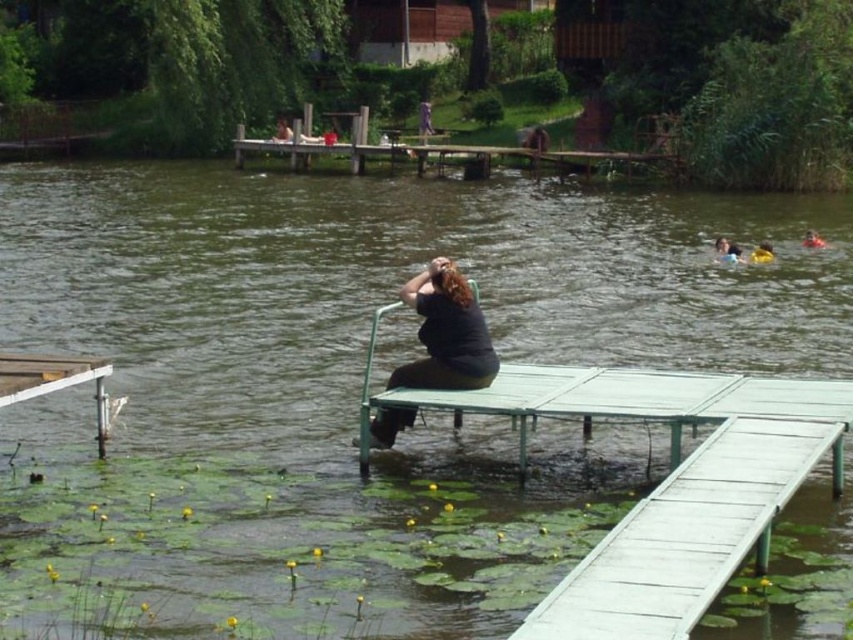
Consider the image. Can you confirm if smooth skin face at upper right is positioned above orange life vest at upper right?

Incorrect, smooth skin face at upper right is not positioned above orange life vest at upper right.

Does smooth skin face at upper right have a smaller size compared to orange life vest at upper right?

Incorrect, smooth skin face at upper right is not smaller in size than orange life vest at upper right.

At what (x,y) coordinates should I click in order to perform the action: click on smooth skin face at upper right. Please return your answer as a coordinate pair (x, y). Looking at the image, I should click on (727, 250).

Is white wood dock at lower right to the left of orange life vest at upper right from the viewer's perspective?

Yes, white wood dock at lower right is to the left of orange life vest at upper right.

Is white wood dock at lower right taller than orange life vest at upper right?

Yes.

You are a GUI agent. You are given a task and a screenshot of the screen. Output one action in this format:
    pyautogui.click(x=<x>, y=<y>)
    Task: Click on the white wood dock at lower right
    Image resolution: width=853 pixels, height=640 pixels.
    Given the screenshot: What is the action you would take?
    pyautogui.click(x=683, y=536)

Identify the location of white wood dock at lower right. (683, 536).

Which of these two, white wood dock at lower right or smooth skin face at upper right, stands shorter?

Standing shorter between the two is smooth skin face at upper right.

Is point (700, 454) positioned in front of point (740, 250)?

Yes, it is.

At what (x,y) coordinates should I click in order to perform the action: click on white wood dock at lower right. Please return your answer as a coordinate pair (x, y). Image resolution: width=853 pixels, height=640 pixels. Looking at the image, I should click on (683, 536).